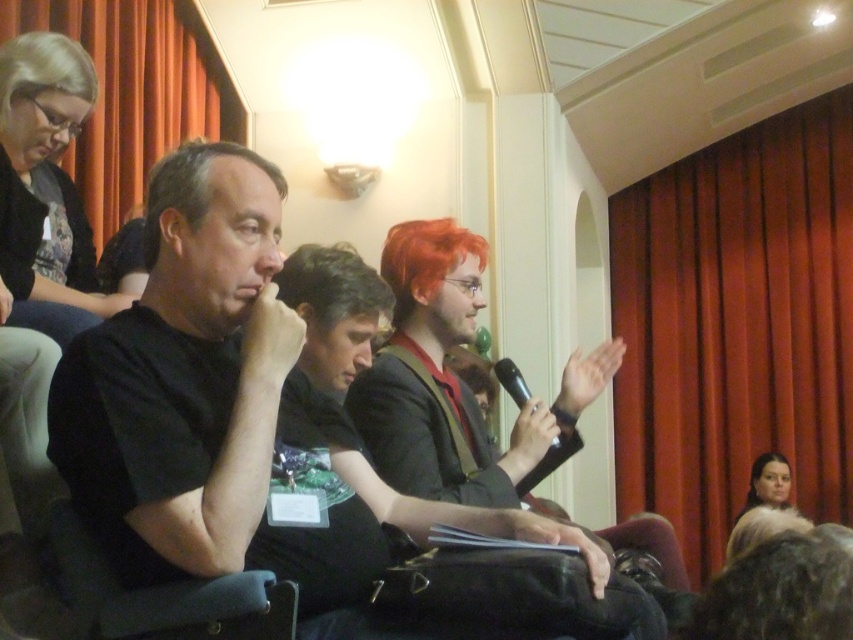
Question: Which point is closer to the camera taking this photo?

Choices:
 (A) (215, 83)
 (B) (282, 195)
 (C) (457, 241)

Answer: (B)

Question: Can you confirm if orange fabric curtain at upper left is thinner than shiny orange wig at center?

Choices:
 (A) no
 (B) yes

Answer: (A)

Question: Does red velvet curtain at right have a greater width compared to brown matte wig at center?

Choices:
 (A) no
 (B) yes

Answer: (B)

Question: Is the position of shiny orange wig at center less distant than that of brown matte wig at center?

Choices:
 (A) yes
 (B) no

Answer: (B)

Question: Among these objects, which one is farthest from the camera?

Choices:
 (A) black plastic microphone at center
 (B) shiny orange wig at center
 (C) shiny red wig at center
 (D) red velvet curtain at right

Answer: (D)

Question: Which object appears farthest from the camera in this image?

Choices:
 (A) fur coat at lower right
 (B) shiny orange wig at center
 (C) orange fabric curtain at upper left
 (D) black plastic microphone at center

Answer: (A)